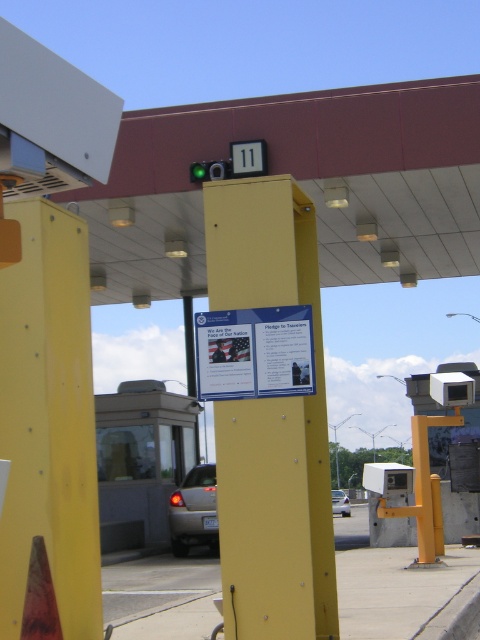
Question: Can you confirm if yellow matte signpost at center is wider than satin silver sedan at lower center?

Choices:
 (A) no
 (B) yes

Answer: (A)

Question: Does yellow matte signpost at center have a lesser width compared to satin silver sedan at lower center?

Choices:
 (A) no
 (B) yes

Answer: (B)

Question: Which of the following is the farthest from the observer?

Choices:
 (A) (192, 502)
 (B) (340, 509)

Answer: (B)

Question: Which of the following is the closest to the observer?

Choices:
 (A) (212, 483)
 (B) (262, 310)
 (C) (262, 273)

Answer: (B)

Question: Which of these objects is positioned farthest from the white paper sign at center?

Choices:
 (A) satin silver sedan at lower center
 (B) yellow matte signpost at center
 (C) silver metallic car at center

Answer: (A)

Question: Observing the image, what is the correct spatial positioning of white paper sign at center in reference to silver metallic car at center?

Choices:
 (A) below
 (B) above

Answer: (B)